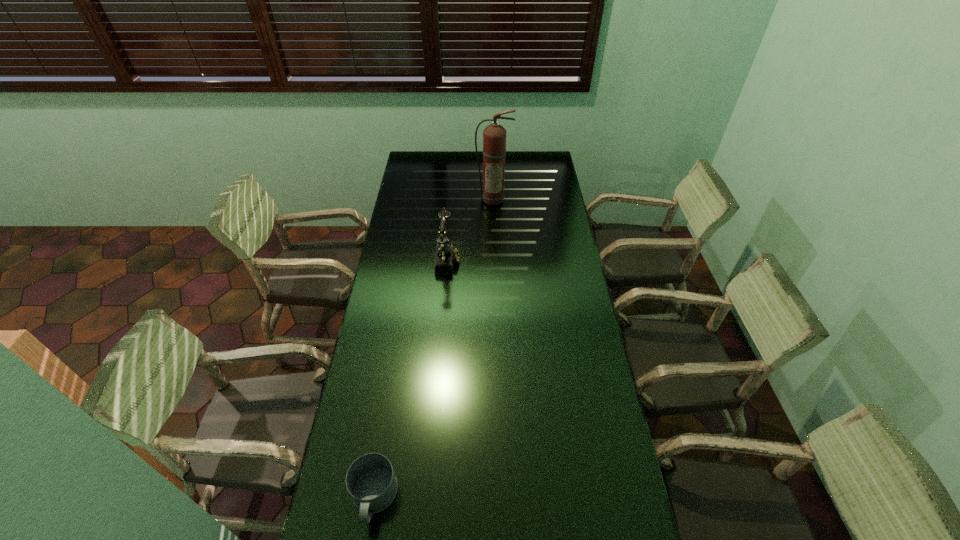
Where is `vacant space that satisfies the following two spatial constraints: 1. on the dial of the second object from left to right; 2. on the side of the nearest object with the handle`? The image size is (960, 540). vacant space that satisfies the following two spatial constraints: 1. on the dial of the second object from left to right; 2. on the side of the nearest object with the handle is located at coordinates (430, 498).

I want to click on free space that satisfies the following two spatial constraints: 1. on the side of the farthest object with the label and nozzle; 2. on the dial of the second farthest object, so 495,259.

Where is `free spot that satisfies the following two spatial constraints: 1. on the dial of the second shortest object; 2. on the side of the mug with the handle`? This screenshot has width=960, height=540. free spot that satisfies the following two spatial constraints: 1. on the dial of the second shortest object; 2. on the side of the mug with the handle is located at coordinates (430, 498).